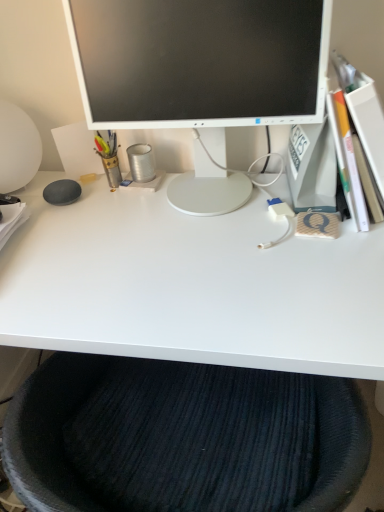
The height and width of the screenshot is (512, 384). Identify the location of vacant space to the right of metallic pen holder at left, which is the first stationery from left to right. (171, 189).